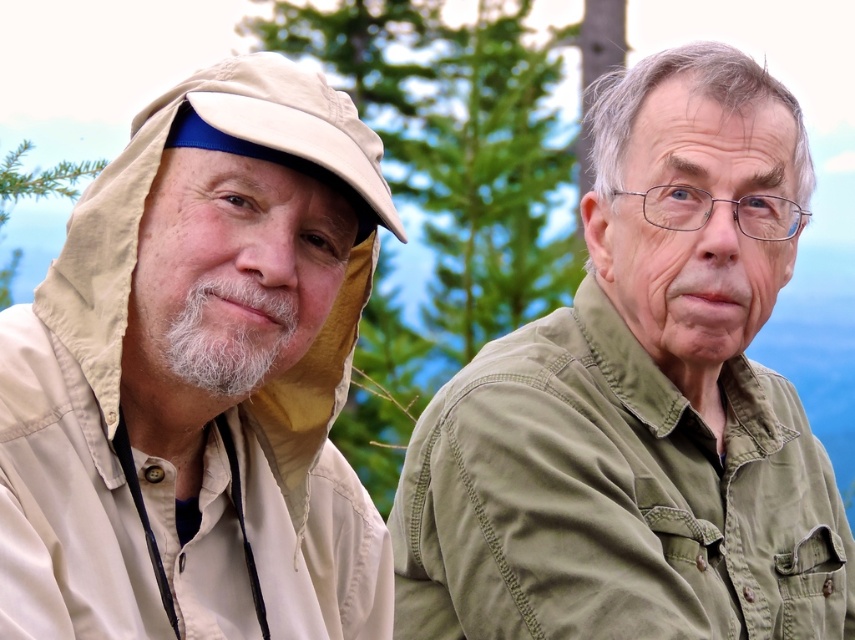
Question: Is beige fabric hat at upper left positioned in front of green cotton shirt at right?

Choices:
 (A) yes
 (B) no

Answer: (A)

Question: Is beige fabric hat at upper left below green cotton shirt at right?

Choices:
 (A) no
 (B) yes

Answer: (A)

Question: Among these objects, which one is farthest from the camera?

Choices:
 (A) green cotton shirt at right
 (B) beige fabric hat at upper left

Answer: (A)

Question: Which of the following is the closest to the observer?

Choices:
 (A) [x=690, y=417]
 (B) [x=32, y=456]

Answer: (B)

Question: From the image, what is the correct spatial relationship of beige fabric hat at upper left in relation to green cotton shirt at right?

Choices:
 (A) right
 (B) left

Answer: (B)

Question: Among these points, which one is farthest from the camera?

Choices:
 (A) (591, 416)
 (B) (59, 296)

Answer: (A)